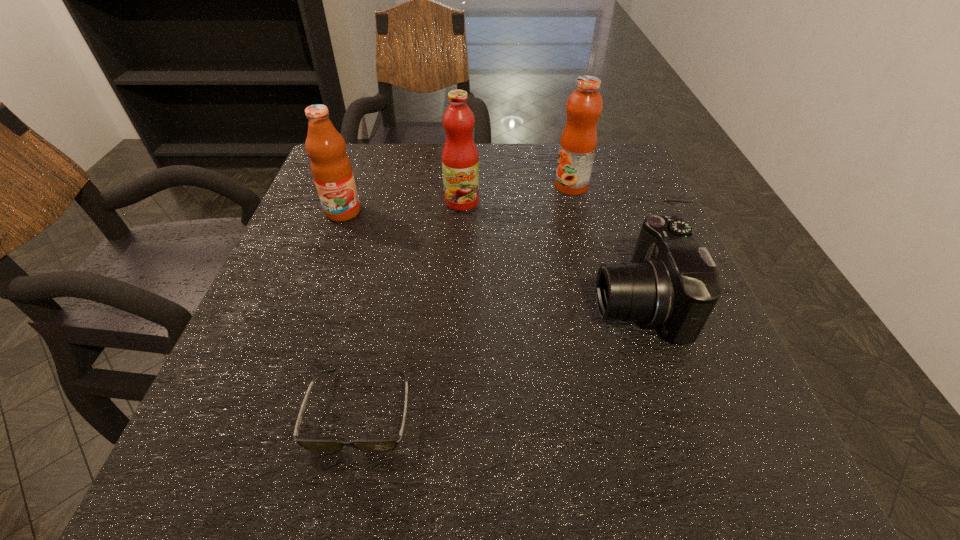
Image resolution: width=960 pixels, height=540 pixels. I want to click on camera situated at the right edge, so click(672, 282).

In order to click on object that is at the near left corner in this screenshot , I will do pyautogui.click(x=388, y=444).

Image resolution: width=960 pixels, height=540 pixels. In order to click on object that is at the far right corner in this screenshot , I will do `click(578, 142)`.

Locate an element on the screen. The image size is (960, 540). vacant space at the far edge is located at coordinates (553, 163).

Where is `vacant area at the near edge of the desktop`? vacant area at the near edge of the desktop is located at coordinates (585, 449).

The height and width of the screenshot is (540, 960). In the image, there is a desktop. In order to click on vacant space at the left edge in this screenshot , I will do `click(335, 243)`.

What are the coordinates of `free location at the right edge of the desktop` in the screenshot? It's located at (696, 427).

In the image, there is a desktop. Find the location of `vacant space at the far left corner`. vacant space at the far left corner is located at coordinates (378, 183).

At what (x,y) coordinates should I click in order to perform the action: click on free location at the far right corner. Please return your answer as a coordinate pair (x, y). This screenshot has height=540, width=960. Looking at the image, I should click on (619, 160).

The height and width of the screenshot is (540, 960). What are the coordinates of `blank region between the fourth tallest object and the second fruit juice from left to right` in the screenshot? It's located at (549, 252).